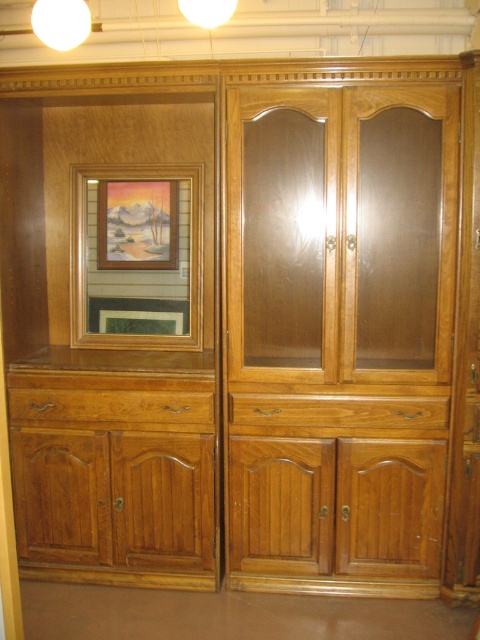
You are standing in front of the wooden cabinet and want to place a decorative item between the framed picture on the left and the point at (264,93). If the item is 1.2 meters wide, will it fit?

The distance between the framed picture on the left and the point at (264,93) is 2.37 meters. Since the decorative item is only 1.2 meters wide, it will fit comfortably within that space.

You are standing in front of the wooden cabinet described. You notice a specific point at coordinates (338,218). What object is located at that point?

The transparent wood cabinet doors at center are located at point (338,218).